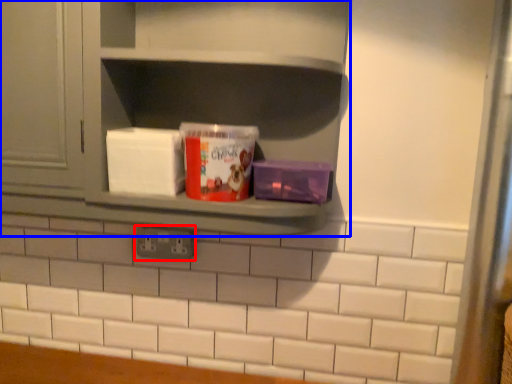
Question: Which object appears closest to the camera in this image, electric outlet (highlighted by a red box) or shelf (highlighted by a blue box)?

Choices:
 (A) electric outlet
 (B) shelf

Answer: (B)